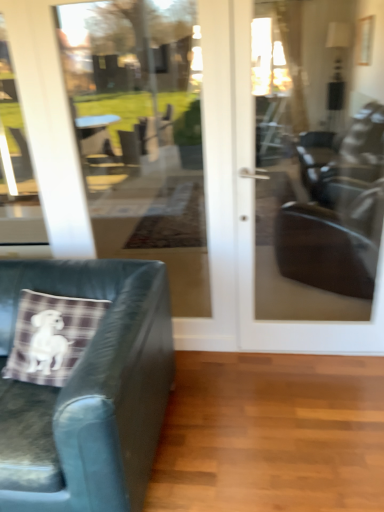
Question: From the image's perspective, is plaid fabric pillow at lower left located beneath leather cushion at left?

Choices:
 (A) no
 (B) yes

Answer: (A)

Question: Does plaid fabric pillow at lower left have a greater width compared to leather cushion at left?

Choices:
 (A) no
 (B) yes

Answer: (A)

Question: Is plaid fabric pillow at lower left taller than leather cushion at left?

Choices:
 (A) yes
 (B) no

Answer: (B)

Question: Is plaid fabric pillow at lower left oriented away from leather cushion at left?

Choices:
 (A) no
 (B) yes

Answer: (B)

Question: From a real-world perspective, is plaid fabric pillow at lower left on top of leather cushion at left?

Choices:
 (A) no
 (B) yes

Answer: (B)

Question: Considering the positions of transparent glass door at upper left and matte glass door at center in the image, is transparent glass door at upper left bigger or smaller than matte glass door at center?

Choices:
 (A) big
 (B) small

Answer: (B)

Question: From the image's perspective, relative to matte glass door at center, is transparent glass door at upper left above or below?

Choices:
 (A) below
 (B) above

Answer: (B)

Question: Based on their positions, is transparent glass door at upper left located to the left or right of matte glass door at center?

Choices:
 (A) left
 (B) right

Answer: (A)

Question: From a real-world perspective, relative to matte glass door at center, is transparent glass door at upper left vertically above or below?

Choices:
 (A) below
 (B) above

Answer: (B)

Question: Considering the positions of transparent glass door at center and matte glass door at center in the image, is transparent glass door at center taller or shorter than matte glass door at center?

Choices:
 (A) tall
 (B) short

Answer: (A)

Question: In the image, is transparent glass door at center on the left side or the right side of matte glass door at center?

Choices:
 (A) right
 (B) left

Answer: (B)

Question: From the image's perspective, is transparent glass door at center positioned above or below matte glass door at center?

Choices:
 (A) above
 (B) below

Answer: (A)

Question: Considering the positions of point (195, 245) and point (380, 243), is point (195, 245) closer or farther from the camera than point (380, 243)?

Choices:
 (A) closer
 (B) farther

Answer: (B)

Question: Based on their sizes in the image, would you say transparent glass door at center is bigger or smaller than plaid fabric pillow at lower left?

Choices:
 (A) big
 (B) small

Answer: (B)

Question: Visually, is transparent glass door at center positioned to the left or to the right of plaid fabric pillow at lower left?

Choices:
 (A) left
 (B) right

Answer: (B)